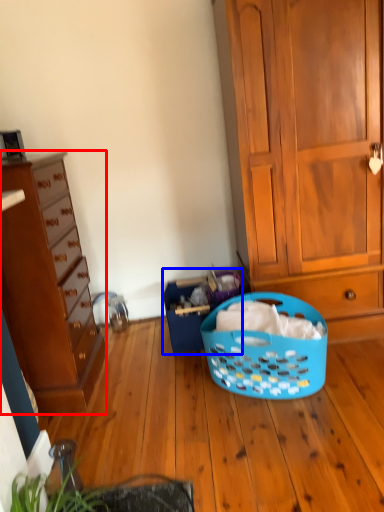
Question: Which object is closer to the camera taking this photo, cabinetry (highlighted by a red box) or shopping basket (highlighted by a blue box)?

Choices:
 (A) cabinetry
 (B) shopping basket

Answer: (A)